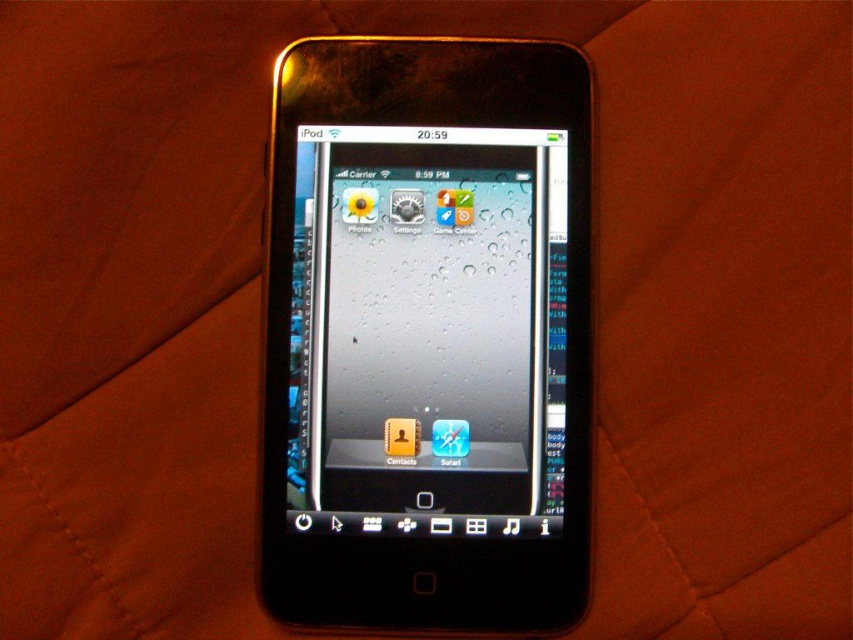
Which is below, black glossy smartphone at center or glossy plastic screen at center?

black glossy smartphone at center is below.

Which of these two, black glossy smartphone at center or glossy plastic screen at center, stands taller?

black glossy smartphone at center is taller.

Which is in front, point (543, 156) or point (399, 481)?

Point (399, 481) is in front.

Identify the location of black glossy smartphone at center. The width and height of the screenshot is (853, 640). (428, 336).